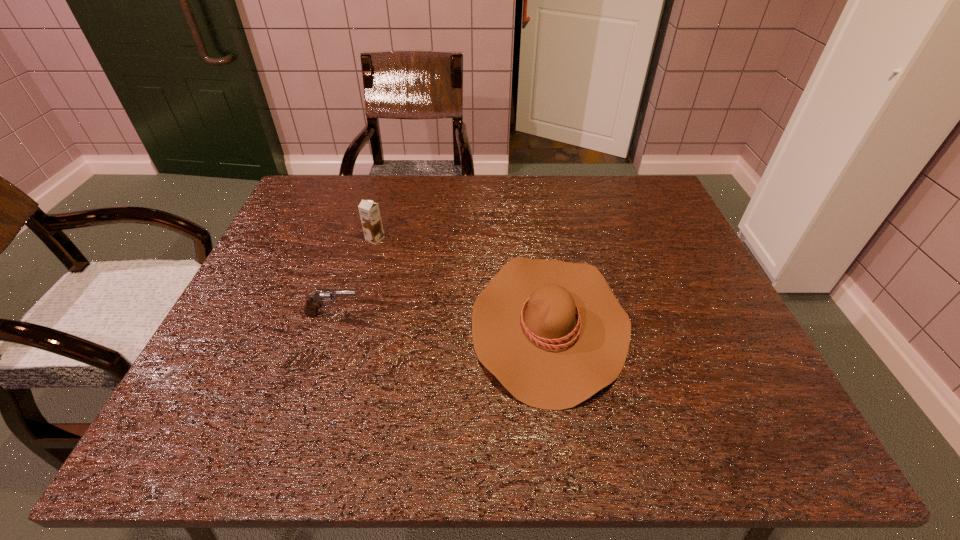
The image size is (960, 540). Find the location of `the tallest object`. the tallest object is located at coordinates (369, 211).

Where is `chocolate milk`? The image size is (960, 540). chocolate milk is located at coordinates (369, 211).

You are a GUI agent. You are given a task and a screenshot of the screen. Output one action in this format:
    pyautogui.click(x=<x>, y=<y>)
    Task: Click on the pistol
    
    Given the screenshot: What is the action you would take?
    pyautogui.click(x=316, y=300)

The width and height of the screenshot is (960, 540). I want to click on cowboy hat, so click(552, 332).

The width and height of the screenshot is (960, 540). What are the coordinates of `vacant region located on the back of the tallest object` in the screenshot? It's located at (391, 182).

Where is `blank space located 0.280m at the barrel of the pistol`? Image resolution: width=960 pixels, height=540 pixels. blank space located 0.280m at the barrel of the pistol is located at coordinates [x=485, y=314].

This screenshot has height=540, width=960. What are the coordinates of `free space located on the back of the rightmost object` in the screenshot? It's located at (538, 245).

This screenshot has height=540, width=960. Find the location of `object that is at the near edge`. object that is at the near edge is located at coordinates (552, 332).

Image resolution: width=960 pixels, height=540 pixels. In order to click on free point at the far edge in this screenshot , I will do `click(463, 179)`.

Locate an element on the screen. vacant area at the left edge is located at coordinates (238, 306).